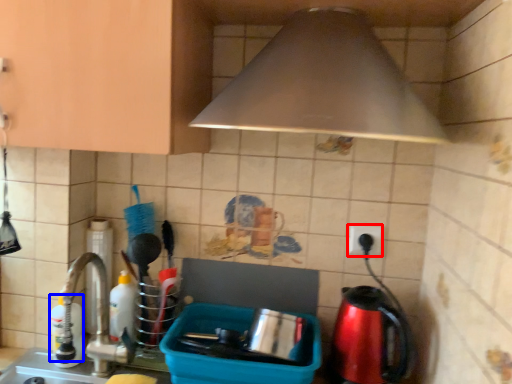
Question: Which object is further to the camera taking this photo, electric outlet (highlighted by a red box) or bottle (highlighted by a blue box)?

Choices:
 (A) electric outlet
 (B) bottle

Answer: (A)